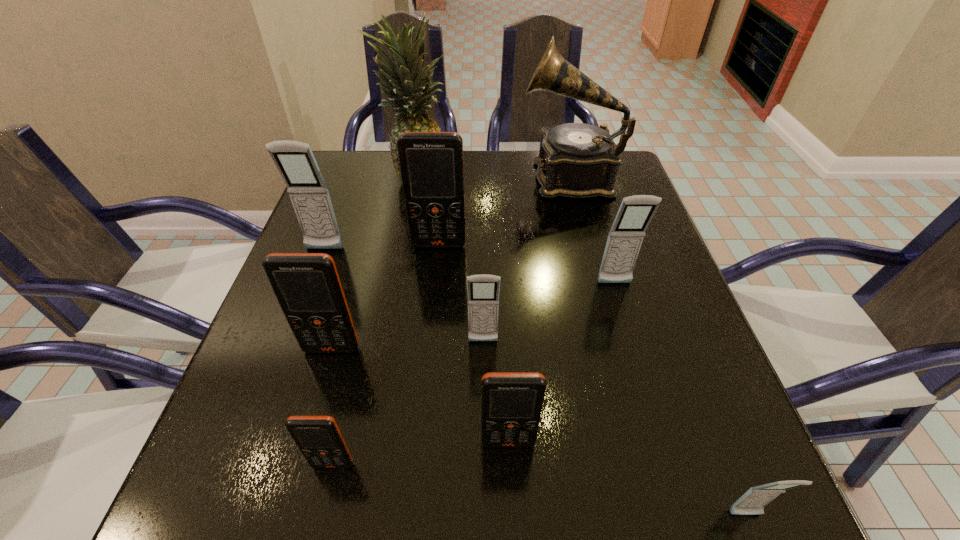
Find the location of a particular element. The width and height of the screenshot is (960, 540). cellular telephone that stands as the seventh closest to the ninth shortest object is located at coordinates (319, 439).

Select which orange cellular telephone is the second closest to the green pineapple. Please provide its 2D coordinates. Your answer should be formatted as a tuple, i.e. [(x, y)], where the tuple contains the x and y coordinates of a point satisfying the conditions above.

[(307, 286)]

Where is `orange cellular telephone that stands as the third closest to the second farthest orange cellular telephone`? The image size is (960, 540). orange cellular telephone that stands as the third closest to the second farthest orange cellular telephone is located at coordinates (511, 402).

Identify which gray cellular telephone is the third nearest to the biggest gray cellular telephone. Please provide its 2D coordinates. Your answer should be formatted as a tuple, i.e. [(x, y)], where the tuple contains the x and y coordinates of a point satisfying the conditions above.

[(753, 502)]

Select which gray cellular telephone is the third closest to the seventh farthest cellular telephone. Please provide its 2D coordinates. Your answer should be formatted as a tuple, i.e. [(x, y)], where the tuple contains the x and y coordinates of a point satisfying the conditions above.

[(753, 502)]

This screenshot has width=960, height=540. What are the coordinates of `free space that satisfies the following two spatial constraints: 1. on the horn of the ninth shortest object; 2. on the screen of the third orange cellular telephone from left to right` in the screenshot? It's located at (588, 245).